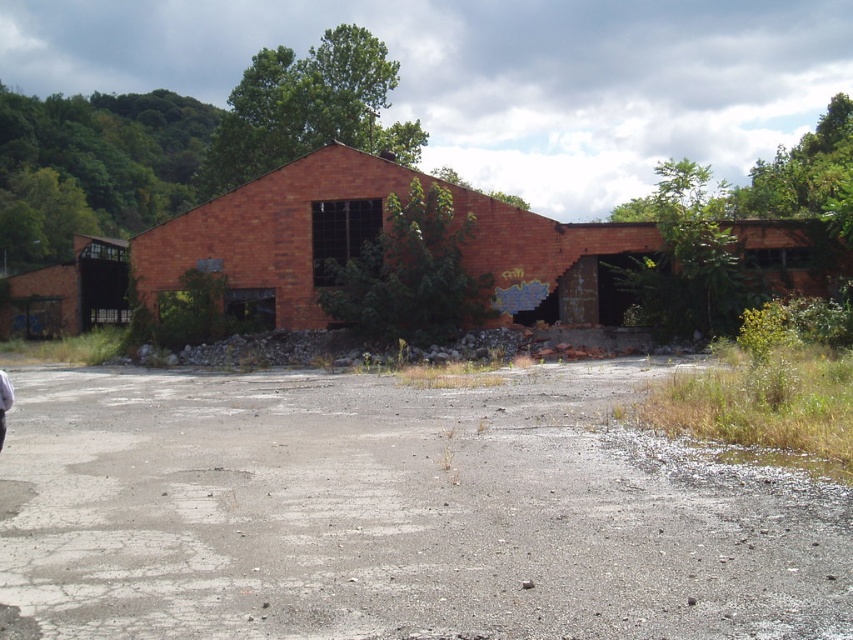
Is point (224, 212) less distant than point (3, 397)?

No.

Is point (155, 248) farther from viewer compared to point (3, 390)?

Yes, it is behind point (3, 390).

Identify the location of red brick building at center. (374, 237).

Is gray asphalt at center bigger than red brick building at center?

No.

Does point (683, 602) come closer to viewer compared to point (173, 269)?

That is True.

You are a GUI agent. You are given a task and a screenshot of the screen. Output one action in this format:
    pyautogui.click(x=<x>, y=<y>)
    Task: Click on the gray asphalt at center
    The height and width of the screenshot is (640, 853).
    Given the screenshot: What is the action you would take?
    pyautogui.click(x=393, y=515)

Consider the image. Does gray asphalt at center appear under brick wall barn at left?

Correct, gray asphalt at center is located below brick wall barn at left.

Between point (141, 532) and point (80, 308), which one is positioned behind?

Positioned behind is point (80, 308).

At what (x,y) coordinates should I click in order to perform the action: click on gray asphalt at center. Please return your answer as a coordinate pair (x, y). Image resolution: width=853 pixels, height=640 pixels. Looking at the image, I should click on (393, 515).